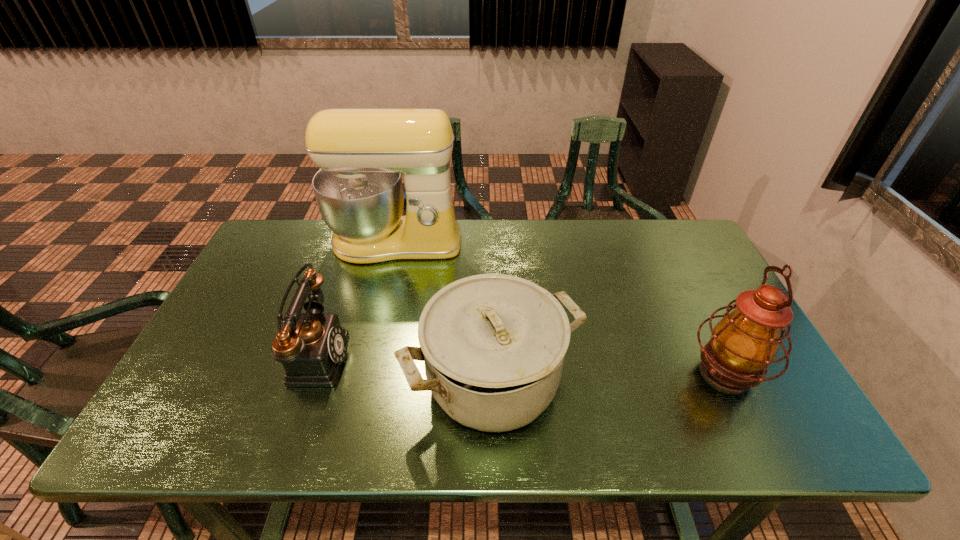
Choose which object is the second nearest neighbor to the saucepan. Please provide its 2D coordinates. Your answer should be formatted as a tuple, i.e. [(x, y)], where the tuple contains the x and y coordinates of a point satisfying the conditions above.

[(361, 153)]

Find the location of a particular element. The image size is (960, 540). the second closest object relative to the third shortest object is located at coordinates (361, 153).

Where is `free space that satisfies the following two spatial constraints: 1. on the side of the mixer with the control knob; 2. on the front of the telephone at the rotary dial`? The width and height of the screenshot is (960, 540). free space that satisfies the following two spatial constraints: 1. on the side of the mixer with the control knob; 2. on the front of the telephone at the rotary dial is located at coordinates point(370,355).

Identify the location of free spot that satisfies the following two spatial constraints: 1. on the front of the telephone at the rotary dial; 2. on the right side of the oil lamp. (308, 373).

Where is `blank space that satisfies the following two spatial constraints: 1. on the front of the telephone at the rotary dial; 2. on the left side of the saucepan`? The height and width of the screenshot is (540, 960). blank space that satisfies the following two spatial constraints: 1. on the front of the telephone at the rotary dial; 2. on the left side of the saucepan is located at coordinates (305, 380).

The image size is (960, 540). Find the location of `free location that satisfies the following two spatial constraints: 1. on the side of the mixer with the control knob; 2. on the right side of the saucepan`. free location that satisfies the following two spatial constraints: 1. on the side of the mixer with the control knob; 2. on the right side of the saucepan is located at coordinates (364, 380).

Locate an element on the screen. The width and height of the screenshot is (960, 540). free location that satisfies the following two spatial constraints: 1. on the front of the telephone at the rotary dial; 2. on the back side of the saucepan is located at coordinates click(305, 380).

Where is `vacant region that satisfies the following two spatial constraints: 1. on the front of the oil lamp at the rotary dial; 2. on the left side of the telephone`? This screenshot has width=960, height=540. vacant region that satisfies the following two spatial constraints: 1. on the front of the oil lamp at the rotary dial; 2. on the left side of the telephone is located at coordinates (308, 373).

I want to click on free point that satisfies the following two spatial constraints: 1. on the back side of the saucepan; 2. on the right side of the rightmost object, so click(x=492, y=373).

This screenshot has width=960, height=540. I want to click on free spot that satisfies the following two spatial constraints: 1. on the front of the third shortest object at the rotary dial; 2. on the right side of the telephone, so click(308, 373).